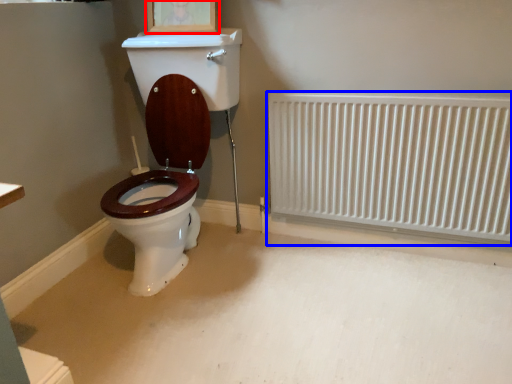
Question: Which object is closer to the camera taking this photo, picture frame (highlighted by a red box) or radiator (highlighted by a blue box)?

Choices:
 (A) picture frame
 (B) radiator

Answer: (B)